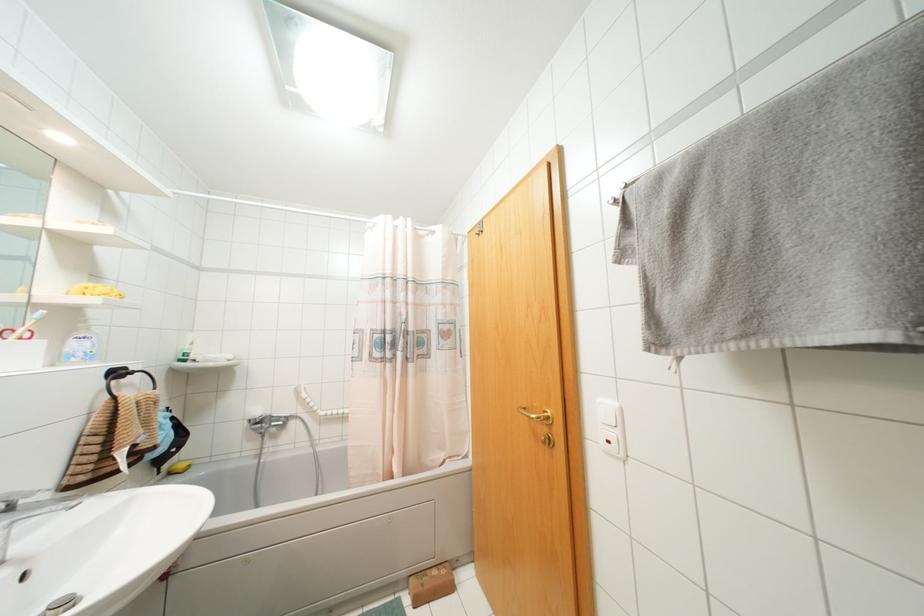
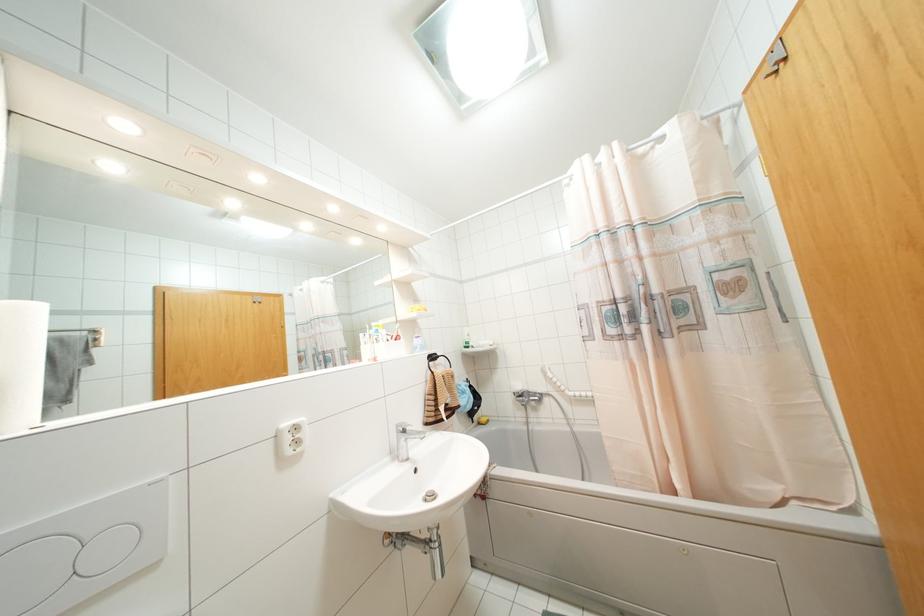
Question: Based on the continuous images, in which direction is the camera rotating? Reply with the corresponding letter.

Choices:
 (A) Left
 (B) Right
 (C) Up
 (D) Down

Answer: (A)